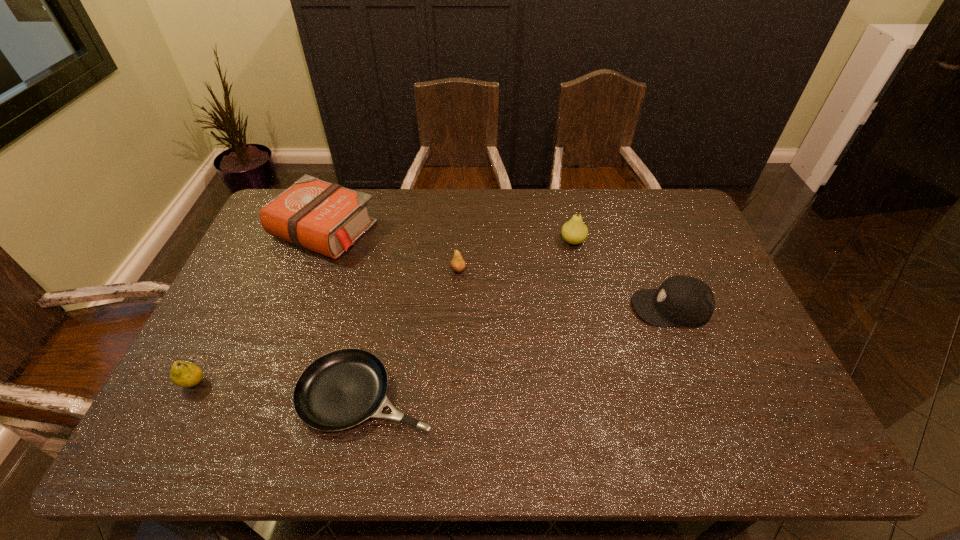
The height and width of the screenshot is (540, 960). Find the location of `pear that is at the left edge`. pear that is at the left edge is located at coordinates (184, 374).

Identify the location of object positioned at the right edge. (686, 301).

Where is `object located in the far left corner section of the desktop`? object located in the far left corner section of the desktop is located at coordinates (327, 218).

The width and height of the screenshot is (960, 540). Find the location of `vacant space at the far edge of the desktop`. vacant space at the far edge of the desktop is located at coordinates (599, 222).

At what (x,y) coordinates should I click in order to perform the action: click on blank space at the near edge of the desktop. Please return your answer as a coordinate pair (x, y). Looking at the image, I should click on (378, 424).

In the image, there is a desktop. At what (x,y) coordinates should I click in order to perform the action: click on vacant space at the left edge. Please return your answer as a coordinate pair (x, y). This screenshot has width=960, height=540. Looking at the image, I should click on (201, 421).

In the image, there is a desktop. At what (x,y) coordinates should I click in order to perform the action: click on free space at the right edge. Please return your answer as a coordinate pair (x, y). The height and width of the screenshot is (540, 960). Looking at the image, I should click on (725, 343).

This screenshot has width=960, height=540. In the image, there is a desktop. Identify the location of vacant space at the far right corner. (644, 211).

Image resolution: width=960 pixels, height=540 pixels. What are the coordinates of `vacant area that lies between the cap and the second object from right to left` in the screenshot? It's located at (622, 274).

Locate an element on the screen. The width and height of the screenshot is (960, 540). free space between the third object from right to left and the rightmost pear is located at coordinates (516, 255).